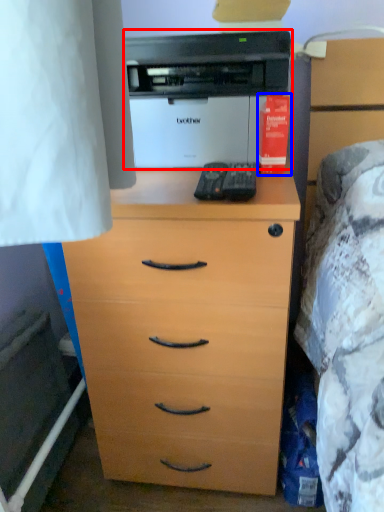
Question: Among these objects, which one is farthest to the camera, printer (highlighted by a red box) or book (highlighted by a blue box)?

Choices:
 (A) printer
 (B) book

Answer: (B)